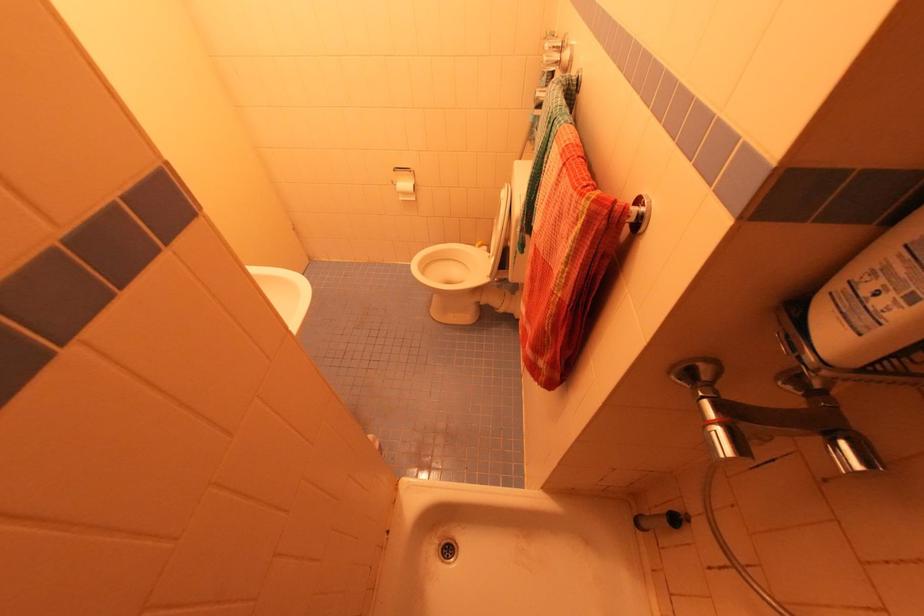
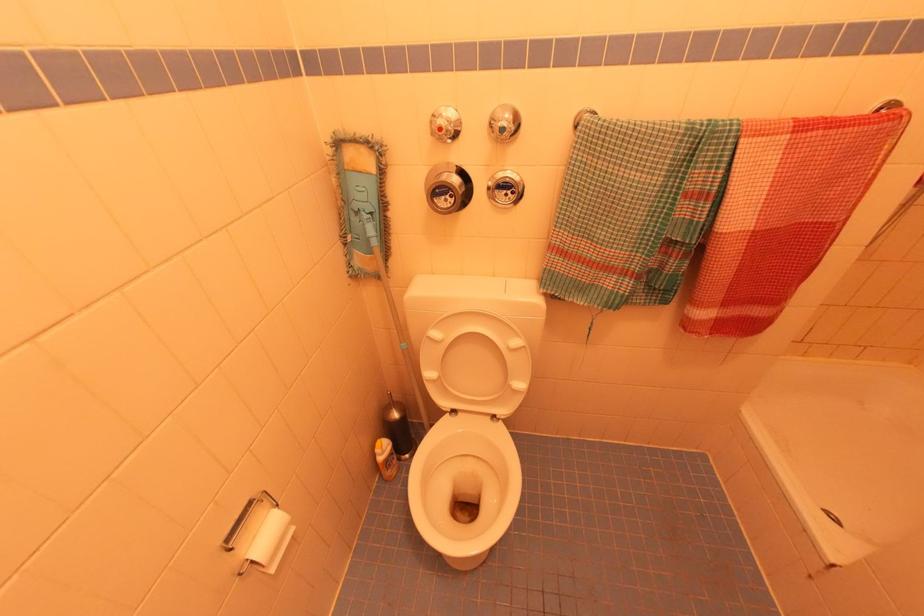
Locate, in the second image, the point that corresponds to pixel 403 200 in the first image.

(274, 570)